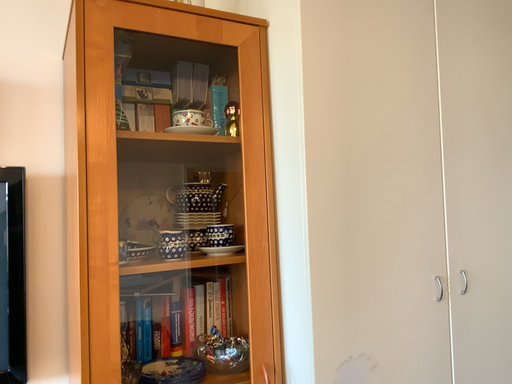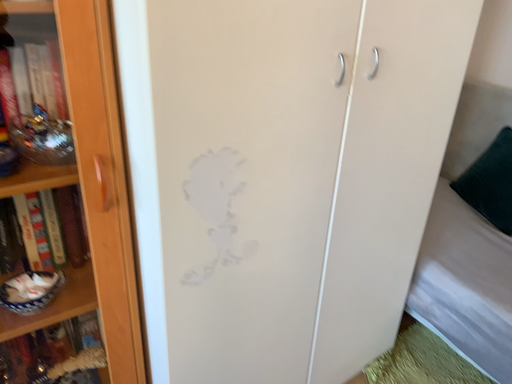
Question: How did the camera likely rotate when shooting the video?

Choices:
 (A) rotated downward
 (B) rotated upward

Answer: (A)